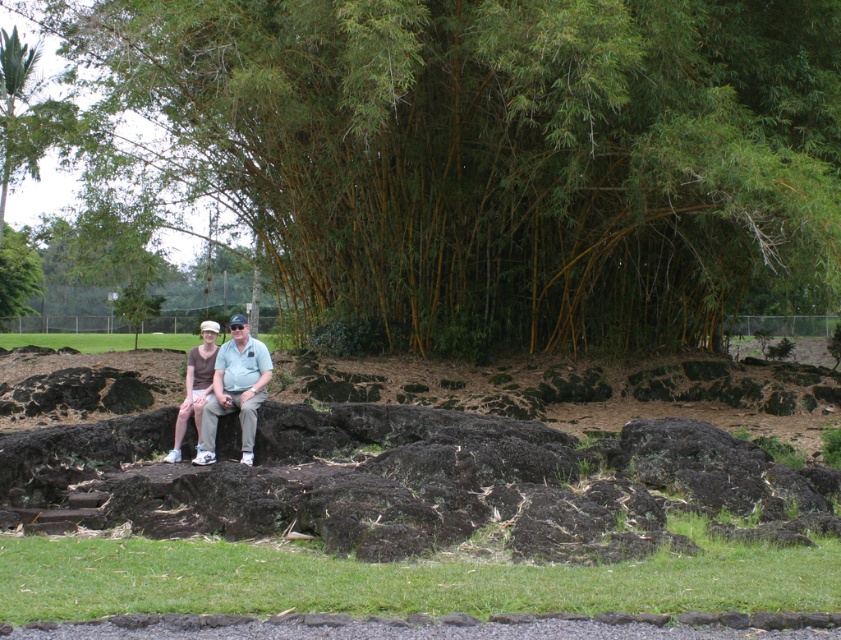
Question: From the image, what is the correct spatial relationship of rough stone bench at center in relation to brown soil at center?

Choices:
 (A) above
 (B) below

Answer: (B)

Question: Which point is farther from the camera taking this photo?

Choices:
 (A) (244, 317)
 (B) (702, 417)
 (C) (191, 355)
 (D) (440, 538)

Answer: (B)

Question: Among these points, which one is farthest from the camera?

Choices:
 (A) (511, 522)
 (B) (664, 380)

Answer: (B)

Question: Does green bamboo at upper center appear on the left side of rough stone bench at center?

Choices:
 (A) yes
 (B) no

Answer: (B)

Question: Is matte green shirt at center bigger than brown cotton shirt at center?

Choices:
 (A) no
 (B) yes

Answer: (B)

Question: Which point is farther to the camera?

Choices:
 (A) (778, 243)
 (B) (604, 531)

Answer: (A)